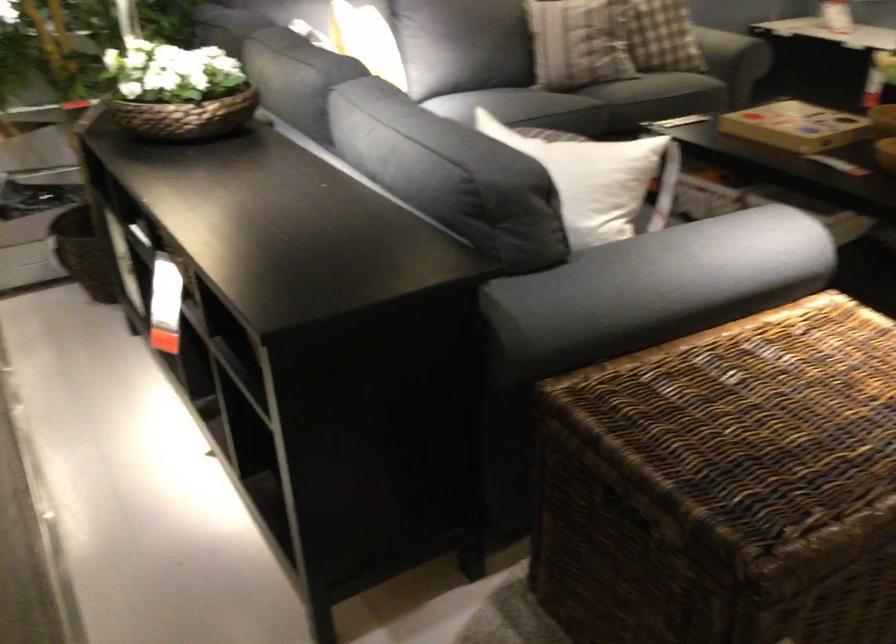
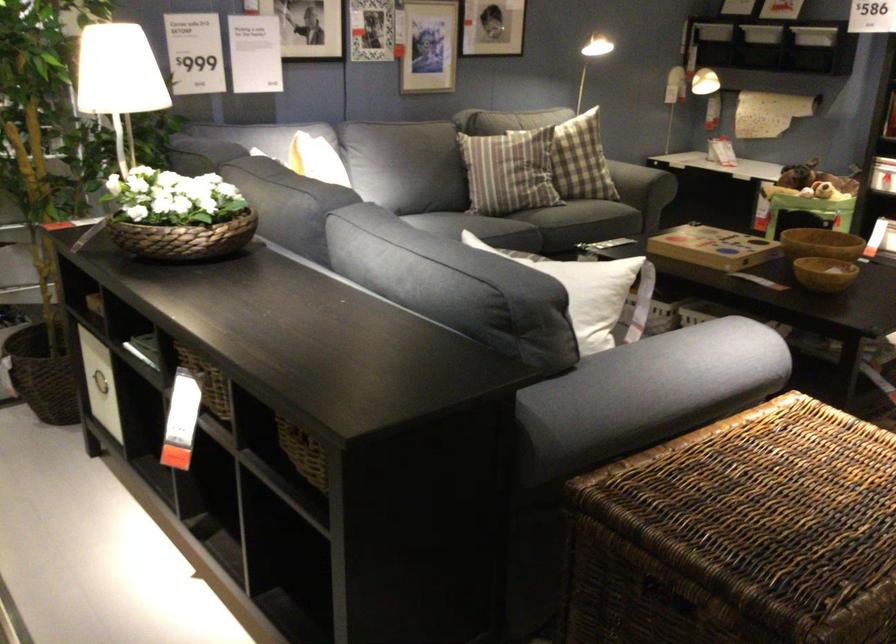
Where in the second image is the point corresponding to (536,91) from the first image?

(484, 227)